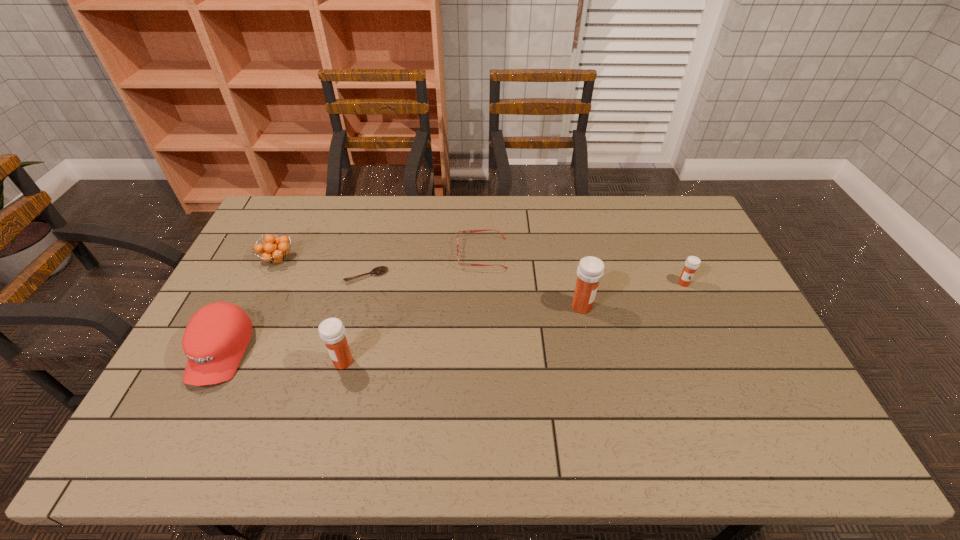
Locate an element on the screen. This screenshot has height=540, width=960. vacant area between the second farthest medicine and the spectacles is located at coordinates (532, 280).

Locate an element on the screen. The width and height of the screenshot is (960, 540). unoccupied position between the soupspoon and the nearest medicine is located at coordinates (x=355, y=319).

This screenshot has height=540, width=960. What are the coordinates of `the fourth closest object to the leftmost medicine` in the screenshot? It's located at (469, 231).

Find the location of a particular element. object that is the third nearest to the third nearest object is located at coordinates (379, 270).

This screenshot has height=540, width=960. Find the location of `medicine identified as the closest to the shortest object`. medicine identified as the closest to the shortest object is located at coordinates pyautogui.click(x=332, y=332).

Choose which medicine is the second nearest neighbor to the soupspoon. Please provide its 2D coordinates. Your answer should be formatted as a tuple, i.e. [(x, y)], where the tuple contains the x and y coordinates of a point satisfying the conditions above.

[(590, 270)]

Locate an element on the screen. The height and width of the screenshot is (540, 960). free spot that satisfies the following two spatial constraints: 1. on the label side of the rightmost medicine; 2. on the label side of the second farthest medicine is located at coordinates (694, 307).

The image size is (960, 540). In order to click on free spot that satisfies the following two spatial constraints: 1. on the label side of the rightmost medicine; 2. on the label side of the sixth shortest object in this screenshot , I will do `click(719, 361)`.